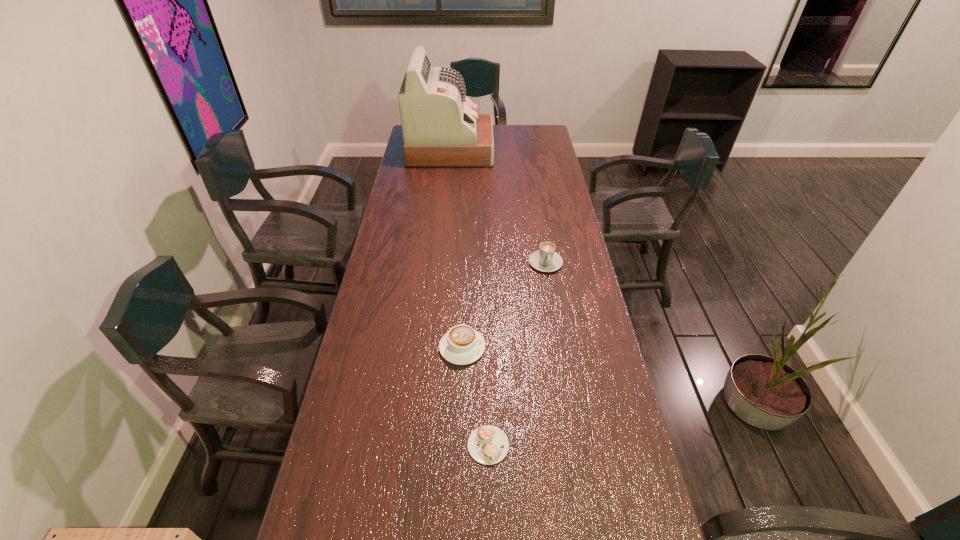
Where is `free space located 0.200m with the handle on the right side of the second farthest cappuccino`? free space located 0.200m with the handle on the right side of the second farthest cappuccino is located at coordinates (550, 347).

I want to click on vacant area situated on the back of the nearest object, so click(488, 381).

The width and height of the screenshot is (960, 540). I want to click on object at the far edge, so click(x=441, y=129).

Where is `object that is at the left edge`? This screenshot has width=960, height=540. object that is at the left edge is located at coordinates (441, 129).

In order to click on object positioned at the right edge in this screenshot , I will do `click(546, 259)`.

I want to click on object present at the far left corner, so click(441, 129).

Where is `vacant space at the left edge of the desktop`? The image size is (960, 540). vacant space at the left edge of the desktop is located at coordinates (341, 463).

In the image, there is a desktop. Find the location of `vacant region at the right edge`. vacant region at the right edge is located at coordinates (592, 446).

You are a GUI agent. You are given a task and a screenshot of the screen. Output one action in this format:
    pyautogui.click(x=<x>, y=<y>)
    Task: Click on the free space between the tallest object and the second farthest cappuccino
    The height and width of the screenshot is (540, 960).
    Given the screenshot: What is the action you would take?
    pyautogui.click(x=456, y=249)

Locate an element on the screen. This screenshot has width=960, height=540. empty space between the third tallest object and the cash register is located at coordinates (456, 249).